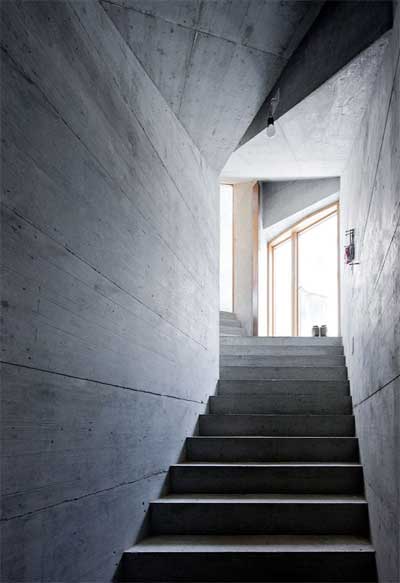
This screenshot has width=400, height=583. I want to click on ceiling, so click(293, 139).